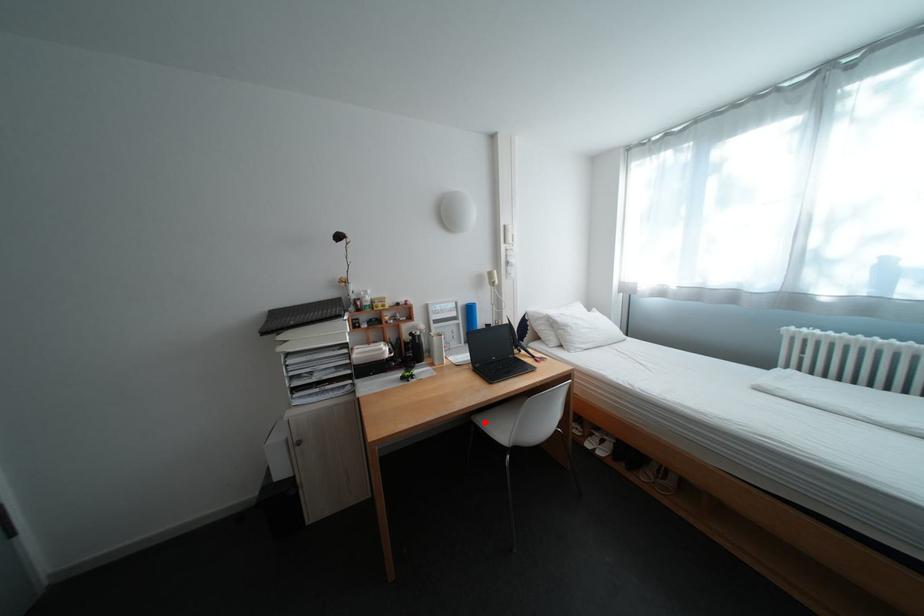
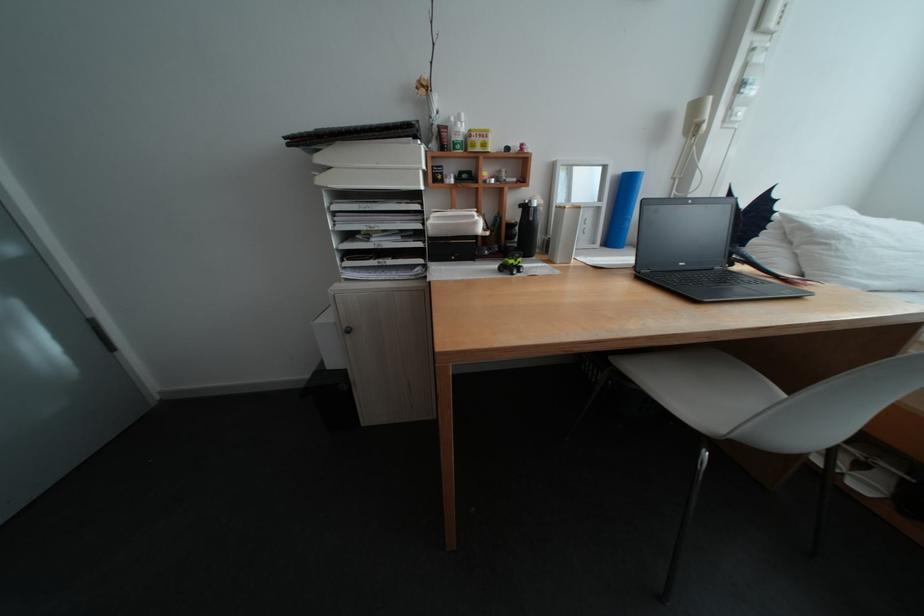
Where in the second image is the point corresponding to the highlighted location from the first image?

(625, 367)